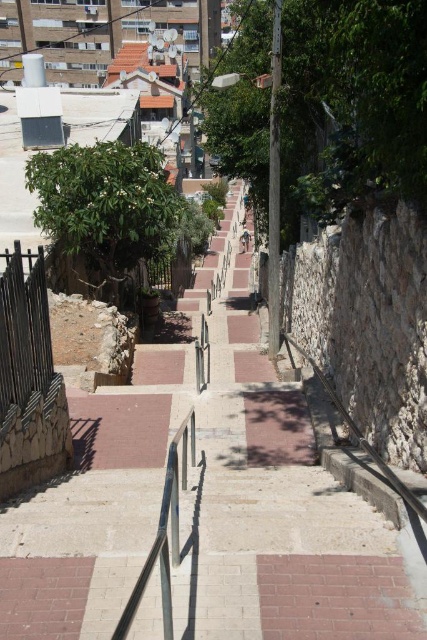
Who is positioned more to the left, brick pavement at center or polished metal rail at center?

Positioned to the left is brick pavement at center.

Can you confirm if brick pavement at center is positioned above polished metal rail at center?

Yes, brick pavement at center is above polished metal rail at center.

Who is more forward, (87, 513) or (114, 632)?

Point (114, 632)

This screenshot has width=427, height=640. In order to click on brick pavement at center in this screenshot , I will do `click(207, 508)`.